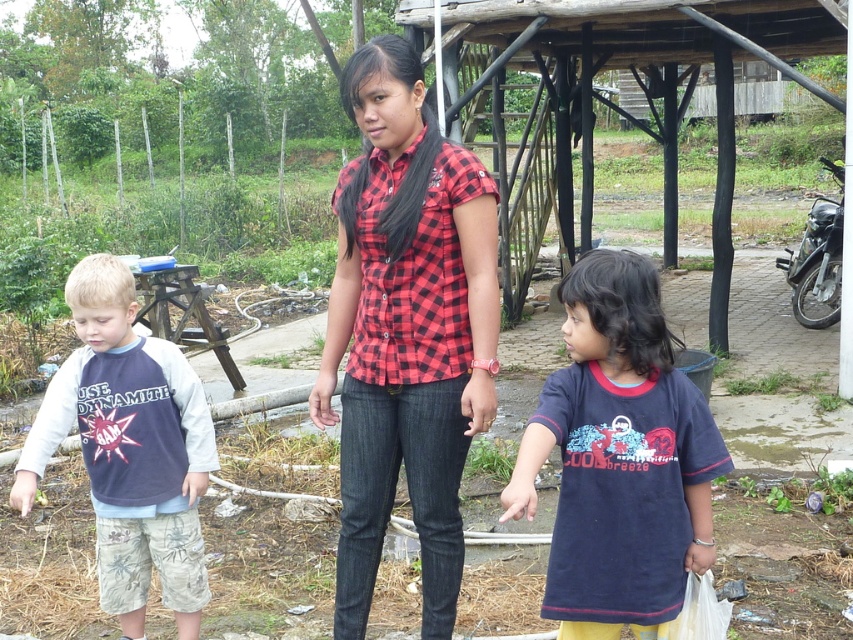
Question: Does red checkered shirt at center appear under dark blue t-shirt at center?

Choices:
 (A) yes
 (B) no

Answer: (B)

Question: Which point appears farthest from the camera in this image?

Choices:
 (A) (194, 608)
 (B) (419, 234)

Answer: (A)

Question: Is red checkered shirt at center above dark blue jersey at left?

Choices:
 (A) yes
 (B) no

Answer: (A)

Question: Which of the following is the farthest from the observer?

Choices:
 (A) (146, 378)
 (B) (662, 452)
 (C) (372, 579)

Answer: (A)

Question: Is red checkered shirt at center to the left of dark blue jersey at left from the viewer's perspective?

Choices:
 (A) yes
 (B) no

Answer: (B)

Question: Which point is farther to the camera?

Choices:
 (A) (370, 196)
 (B) (556, 516)

Answer: (A)